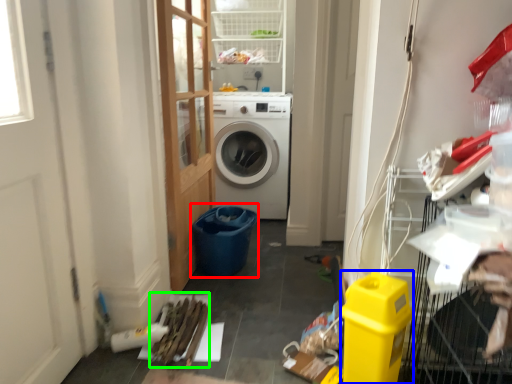
Question: Based on their relative distances, which object is farther from recycling bin (highlighted by a red box)? Choose from appliance (highlighted by a blue box) and debris (highlighted by a green box).

Choices:
 (A) appliance
 (B) debris

Answer: (A)